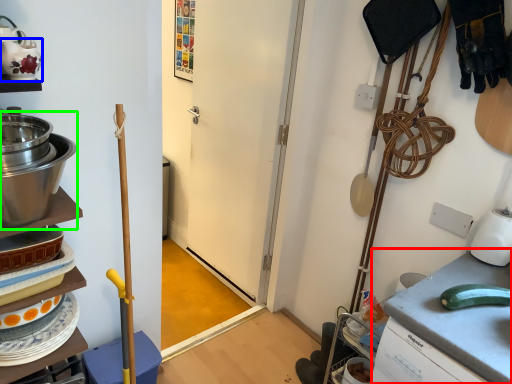
Question: Which object is the closest to the counter top (highlighted by a red box)? Choose among these: tea pot (highlighted by a blue box) or appliance (highlighted by a green box).

Choices:
 (A) tea pot
 (B) appliance

Answer: (B)